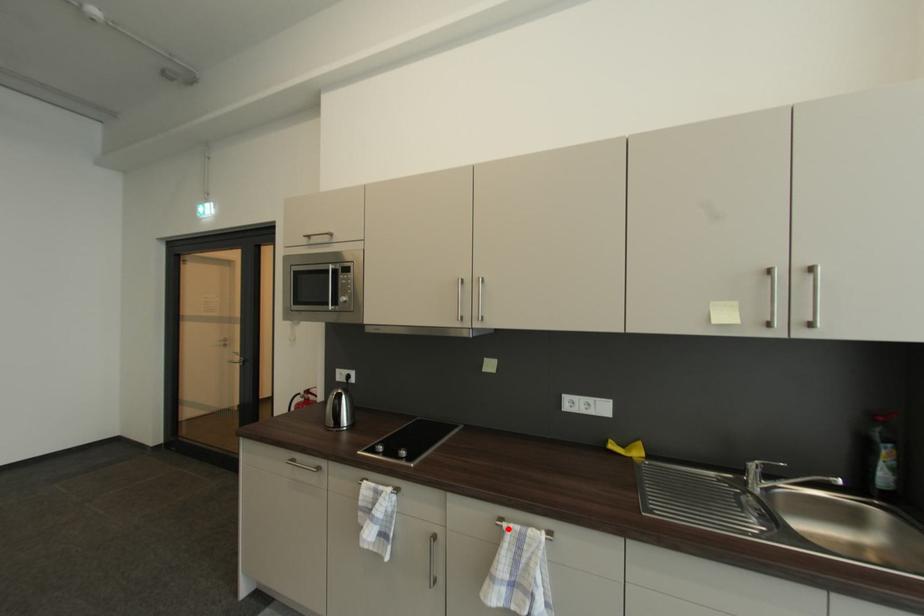
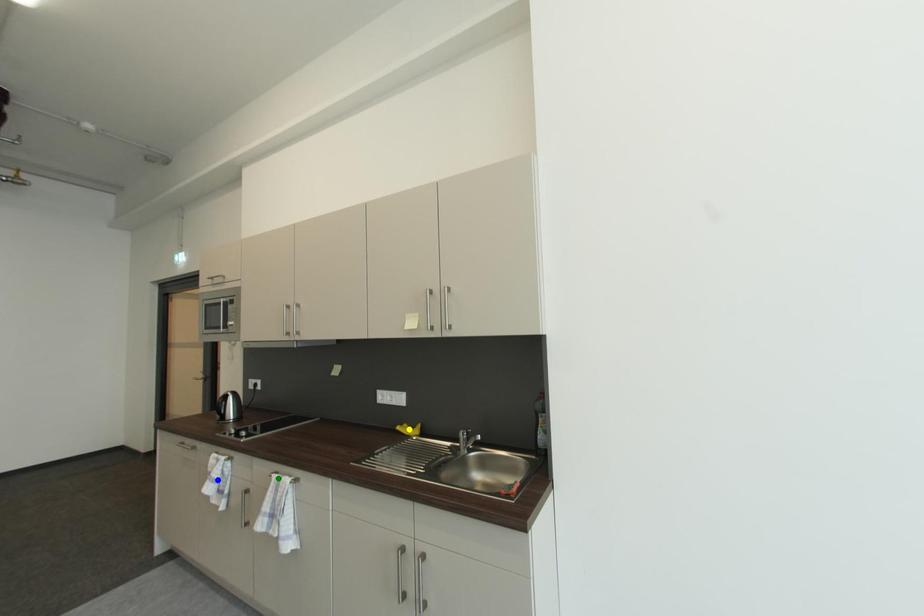
Question: I am providing you with two images of the same scene from different viewpoints. A red point is marked on the first image. You are given multiple points on the second image. Can you choose the point in image 2 that corresponds to the point in image 1?

Choices:
 (A) yellow point
 (B) green point
 (C) blue point

Answer: (B)